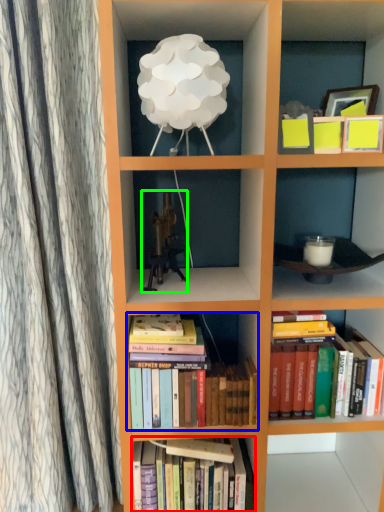
Question: Considering the real-world distances, which object is farthest from book (highlighted by a red box)? book (highlighted by a blue box) or toy (highlighted by a green box)?

Choices:
 (A) book
 (B) toy

Answer: (B)